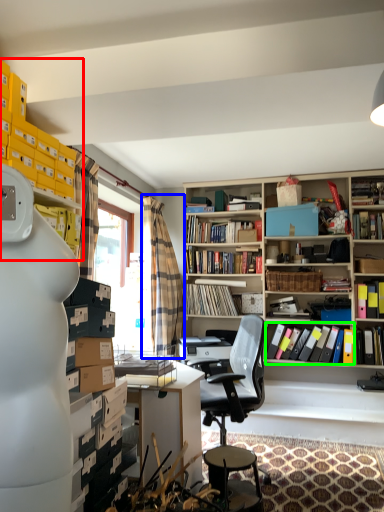
Question: Which is farther away from shelf (highlighted by a red box)? curtain (highlighted by a blue box) or book (highlighted by a green box)?

Choices:
 (A) curtain
 (B) book

Answer: (B)